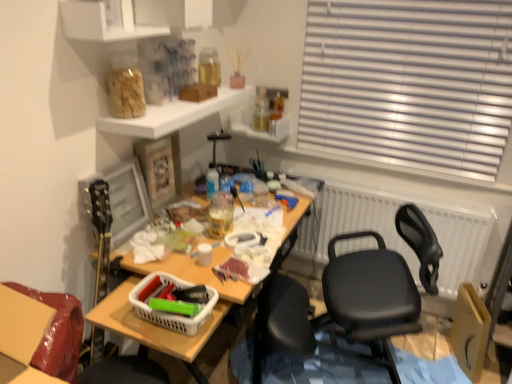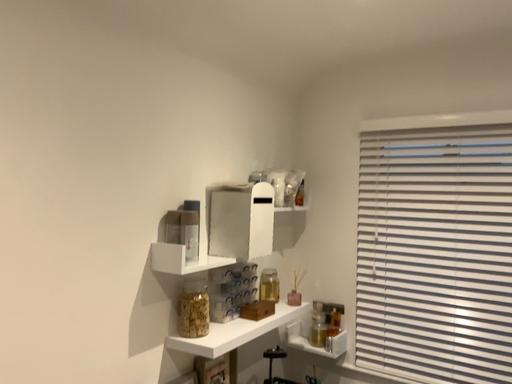
Question: Which way did the camera rotate in the video?

Choices:
 (A) rotated right
 (B) rotated left

Answer: (B)